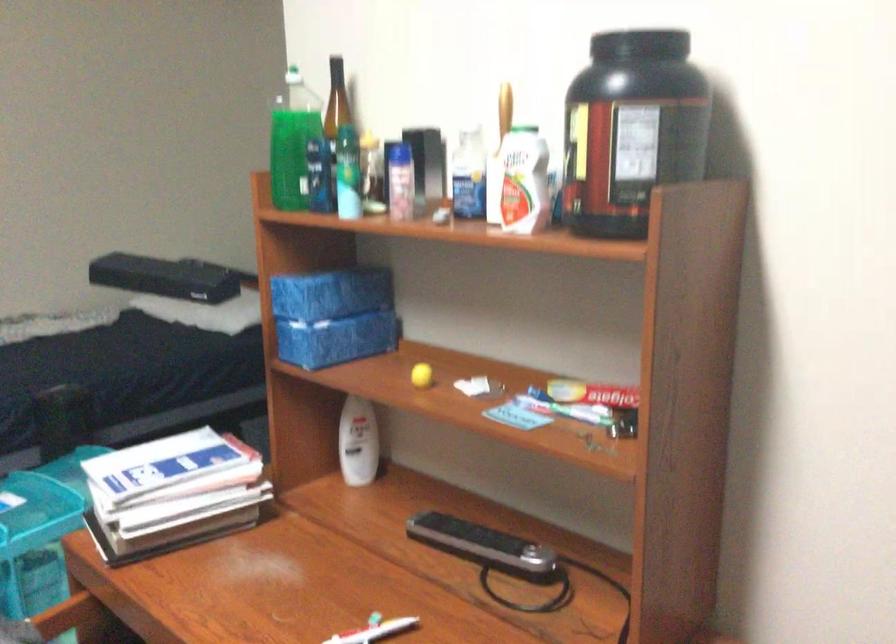
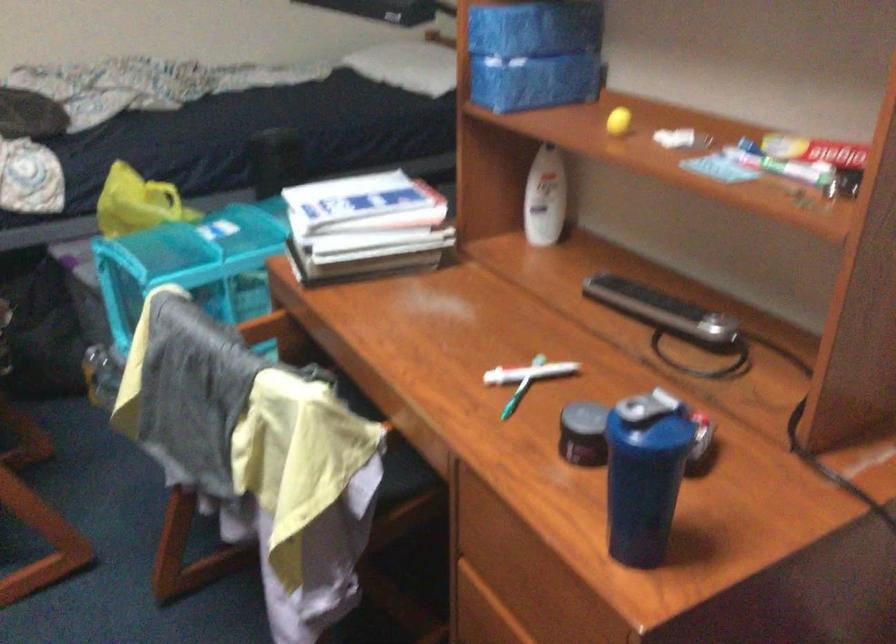
Where in the second image is the point corresponding to point (485, 545) from the first image?

(661, 308)